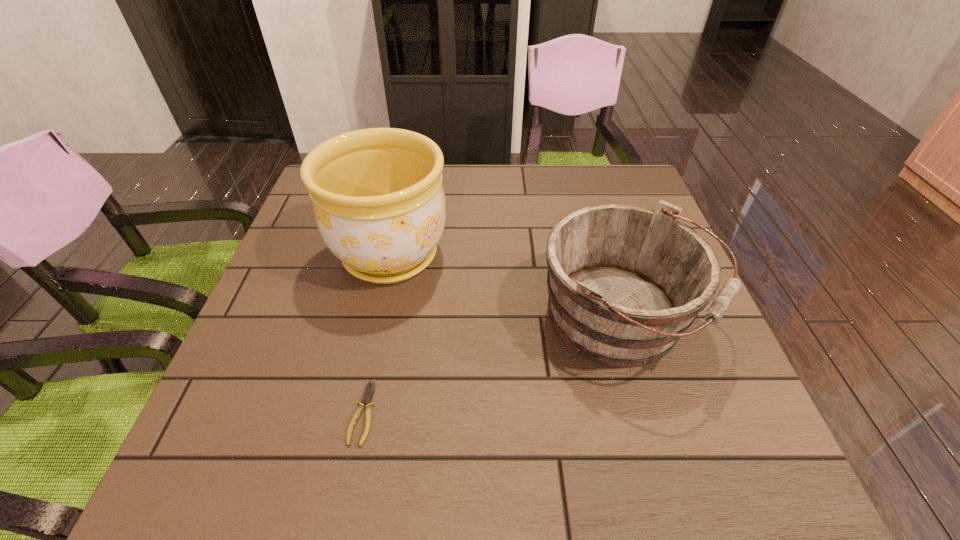
In the image, there is a desktop. What are the coordinates of `free space at the far edge` in the screenshot? It's located at (493, 206).

In the image, there is a desktop. Where is `vacant area at the near edge`? vacant area at the near edge is located at coordinates (583, 487).

The height and width of the screenshot is (540, 960). In the image, there is a desktop. Identify the location of free space at the left edge. (314, 214).

You are a GUI agent. You are given a task and a screenshot of the screen. Output one action in this format:
    pyautogui.click(x=<x>, y=<y>)
    Task: Click on the vacant position at the right edge of the desktop
    Image resolution: width=960 pixels, height=540 pixels.
    Given the screenshot: What is the action you would take?
    pyautogui.click(x=706, y=332)

Locate an element on the screen. This screenshot has height=540, width=960. vacant area at the far left corner of the desktop is located at coordinates (309, 208).

In the image, there is a desktop. Where is `free space at the near left corner`? This screenshot has height=540, width=960. free space at the near left corner is located at coordinates (237, 471).

Where is `blank space at the near right corner`? blank space at the near right corner is located at coordinates (717, 478).

At what (x,y) coordinates should I click in order to perform the action: click on vacant space that is in between the rightmost object and the shortest object. Please return your answer as a coordinate pair (x, y). The image size is (960, 540). Looking at the image, I should click on (492, 366).

At what (x,y) coordinates should I click in order to perform the action: click on vacant area between the pliers and the flowerpot. Please return your answer as a coordinate pair (x, y). This screenshot has height=540, width=960. Looking at the image, I should click on (376, 334).

Find the location of `free space between the tallest object and the shortest object`. free space between the tallest object and the shortest object is located at coordinates (376, 334).